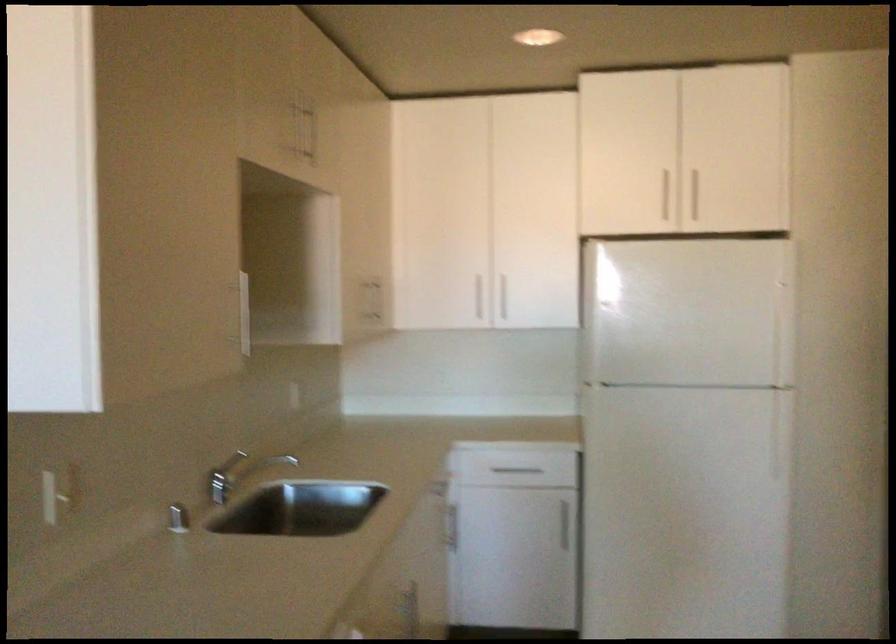
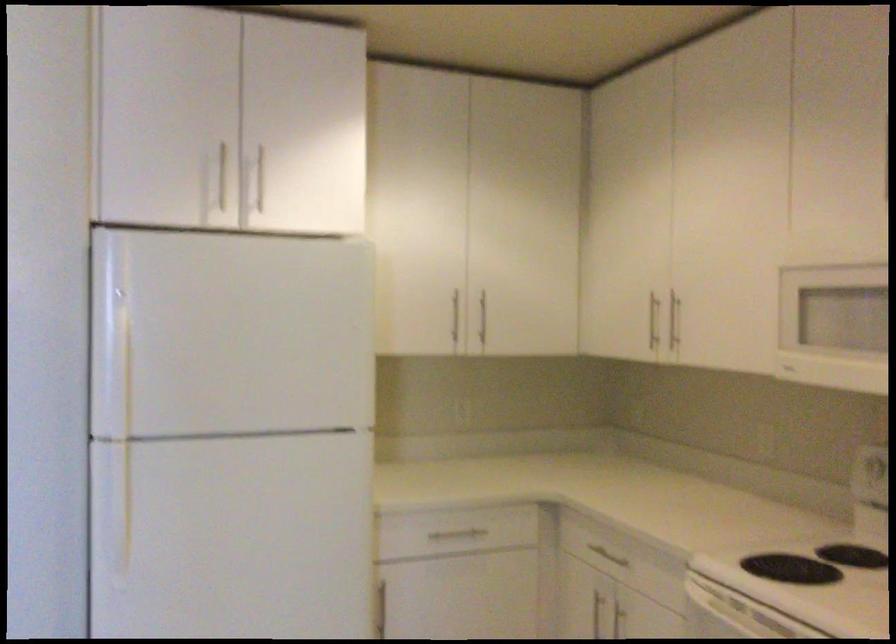
In a continuous first-person perspective shot, in which direction is the camera moving?

The cameraman walked toward right, forward.